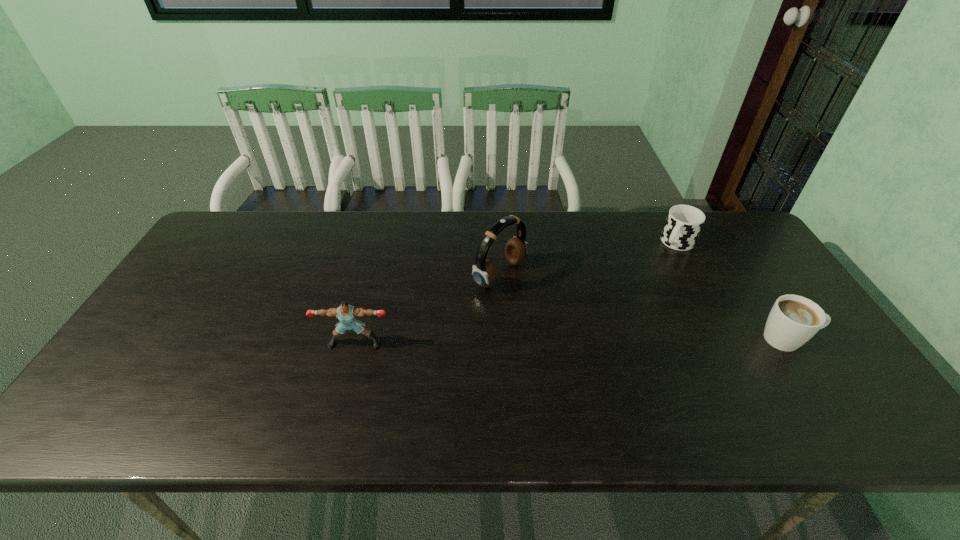
Image resolution: width=960 pixels, height=540 pixels. I want to click on the third shortest object, so click(x=346, y=314).

Identify the location of the leftmost object. Image resolution: width=960 pixels, height=540 pixels. (346, 314).

I want to click on the rightmost object, so point(793,320).

Find the location of a particular element. Image resolution: width=960 pixels, height=540 pixels. the second farthest object is located at coordinates (484, 274).

Image resolution: width=960 pixels, height=540 pixels. Find the location of `the third object from right to left`. the third object from right to left is located at coordinates (484, 274).

Locate an element on the screen. cup is located at coordinates (683, 224).

Image resolution: width=960 pixels, height=540 pixels. I want to click on the second object from right to left, so click(x=683, y=224).

Locate an element on the screen. Image resolution: width=960 pixels, height=540 pixels. free space located 0.050m on the front-facing side of the leftmost object is located at coordinates (348, 366).

Locate an element on the screen. The width and height of the screenshot is (960, 540). vacant area situated 0.110m on the ear cup of the second object from left to right is located at coordinates (554, 307).

Identify the location of vacant area situated 0.290m on the ear cup of the second object from left to right. (612, 341).